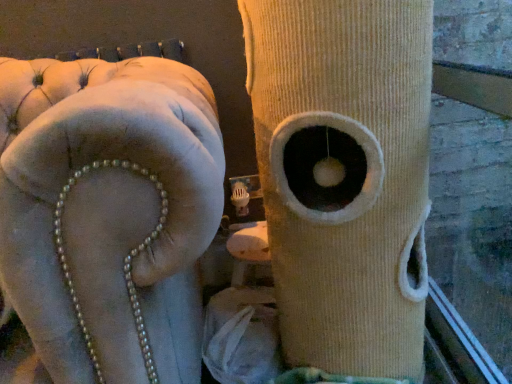
Question: Is velvet beige sofa at upper left oriented towards beige corduroy cat tree at center?

Choices:
 (A) no
 (B) yes

Answer: (A)

Question: Can beige corduroy cat tree at center be found inside velvet beige sofa at upper left?

Choices:
 (A) no
 (B) yes

Answer: (A)

Question: From a real-world perspective, is velvet beige sofa at upper left over beige corduroy cat tree at center?

Choices:
 (A) yes
 (B) no

Answer: (B)

Question: Is velvet beige sofa at upper left with beige corduroy cat tree at center?

Choices:
 (A) no
 (B) yes

Answer: (A)

Question: From the image's perspective, is velvet beige sofa at upper left on beige corduroy cat tree at center?

Choices:
 (A) no
 (B) yes

Answer: (A)

Question: Considering the relative sizes of velvet beige sofa at upper left and beige corduroy cat tree at center in the image provided, is velvet beige sofa at upper left wider than beige corduroy cat tree at center?

Choices:
 (A) yes
 (B) no

Answer: (A)

Question: Are beige corduroy cat tree at center and velvet beige sofa at upper left making contact?

Choices:
 (A) yes
 (B) no

Answer: (B)

Question: Is beige corduroy cat tree at center shorter than velvet beige sofa at upper left?

Choices:
 (A) yes
 (B) no

Answer: (A)

Question: Could you tell me if beige corduroy cat tree at center is facing velvet beige sofa at upper left?

Choices:
 (A) no
 (B) yes

Answer: (A)

Question: From the image's perspective, is beige corduroy cat tree at center under velvet beige sofa at upper left?

Choices:
 (A) yes
 (B) no

Answer: (B)

Question: Considering the relative sizes of beige corduroy cat tree at center and velvet beige sofa at upper left in the image provided, is beige corduroy cat tree at center smaller than velvet beige sofa at upper left?

Choices:
 (A) yes
 (B) no

Answer: (A)

Question: Is beige corduroy cat tree at center bigger than velvet beige sofa at upper left?

Choices:
 (A) yes
 (B) no

Answer: (B)

Question: Considering their positions, is beige corduroy cat tree at center located in front of or behind velvet beige sofa at upper left?

Choices:
 (A) behind
 (B) front

Answer: (A)